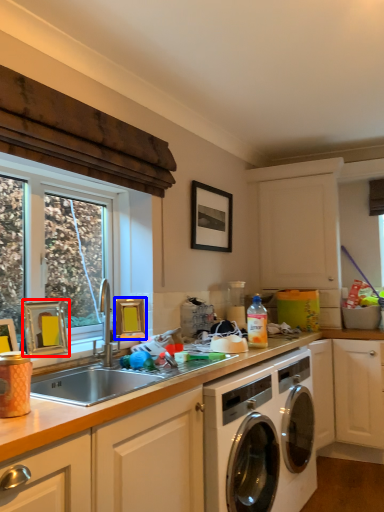
Question: Among these objects, which one is farthest to the camera, picture frame (highlighted by a red box) or picture frame (highlighted by a blue box)?

Choices:
 (A) picture frame
 (B) picture frame

Answer: (B)